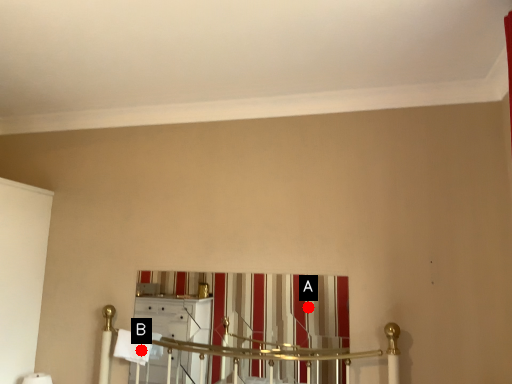
Question: Two points are circled on the image, labeled by A and B beside each circle. Among these points, which one is nearest to the camera?

Choices:
 (A) A is closer
 (B) B is closer

Answer: (A)